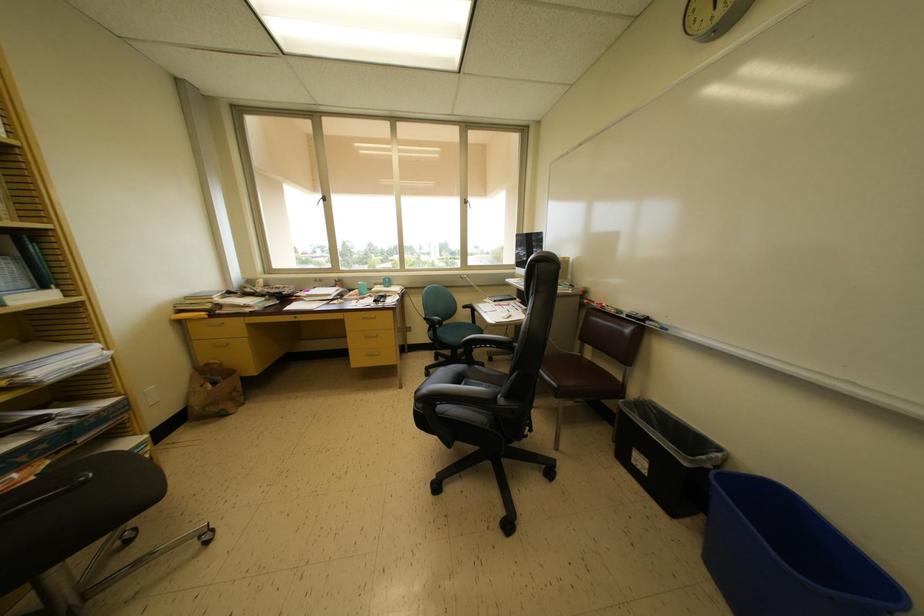
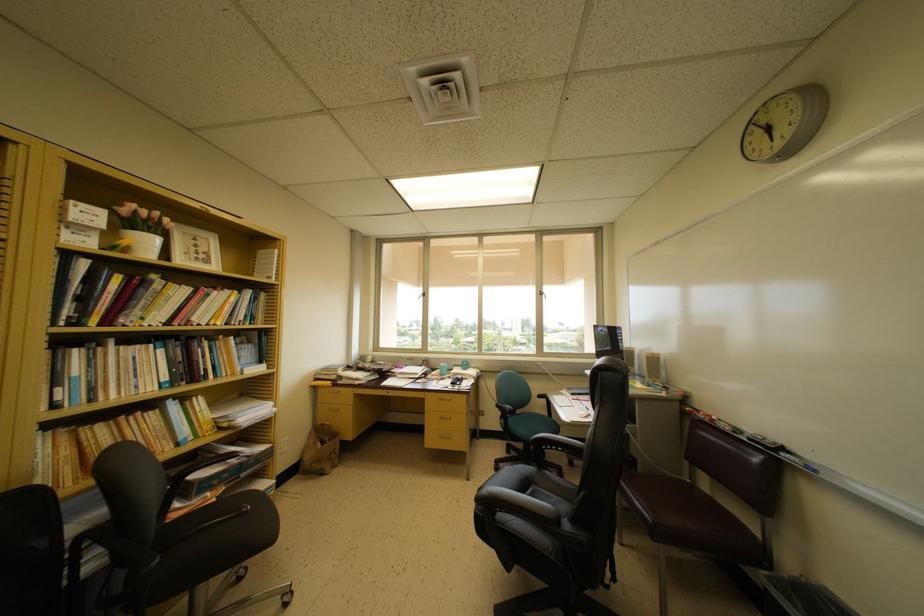
Find the pixel in the second image that matches pixel 200 413 in the first image.

(310, 468)